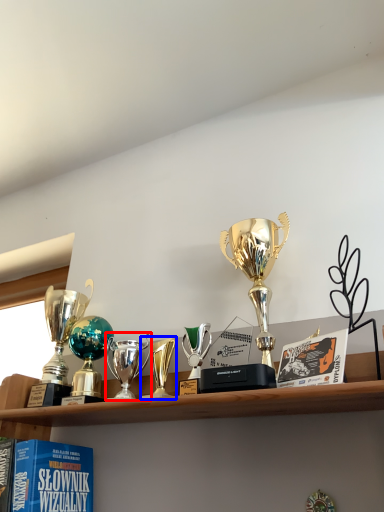
Question: Which object appears farthest to the camera in this image, trophy (highlighted by a red box) or trophy (highlighted by a blue box)?

Choices:
 (A) trophy
 (B) trophy

Answer: (A)